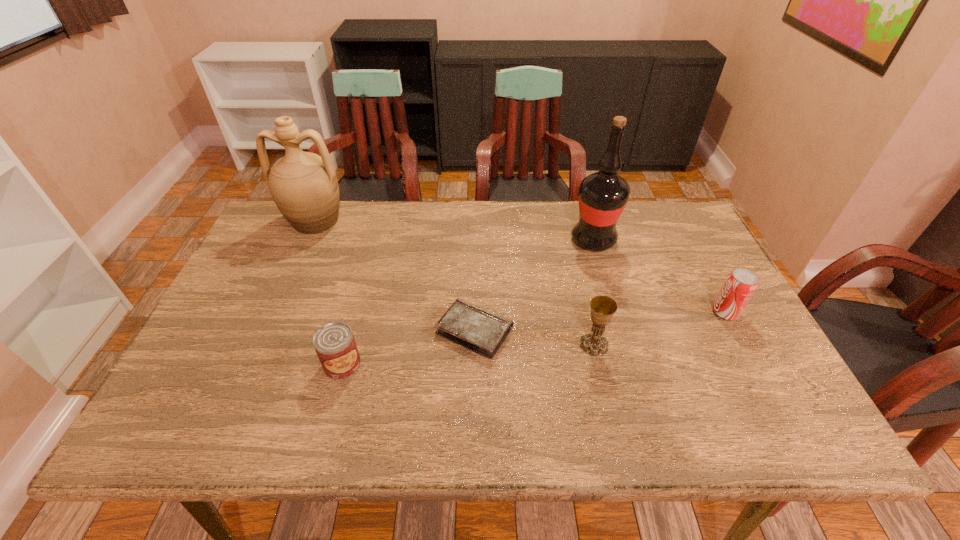
This screenshot has width=960, height=540. In order to click on wine bottle in this screenshot , I will do `click(602, 196)`.

The image size is (960, 540). What are the coordinates of `pitcher` in the screenshot? It's located at (303, 185).

Locate an element on the screen. The image size is (960, 540). chalice is located at coordinates (603, 308).

I want to click on soda can, so click(x=739, y=286).

Find the location of a particular element. This screenshot has height=540, width=960. the second shortest object is located at coordinates (334, 343).

You are a GUI agent. You are given a task and a screenshot of the screen. Output one action in this format:
    pyautogui.click(x=<x>, y=<y>)
    Task: Click on the second object from left to right
    
    Given the screenshot: What is the action you would take?
    pyautogui.click(x=334, y=343)

Where is `diary`? The width and height of the screenshot is (960, 540). diary is located at coordinates (483, 332).

I want to click on the shortest object, so click(483, 332).

Find the location of a particular element. This screenshot has height=540, width=960. free space located 0.060m on the back of the wine bottle is located at coordinates (586, 215).

You are a GUI agent. You are given a task and a screenshot of the screen. Output one action in this format:
    pyautogui.click(x=<x>, y=<y>)
    Task: Click on the vacant area situated on the front of the leftmost object
    
    Given the screenshot: What is the action you would take?
    pyautogui.click(x=278, y=302)